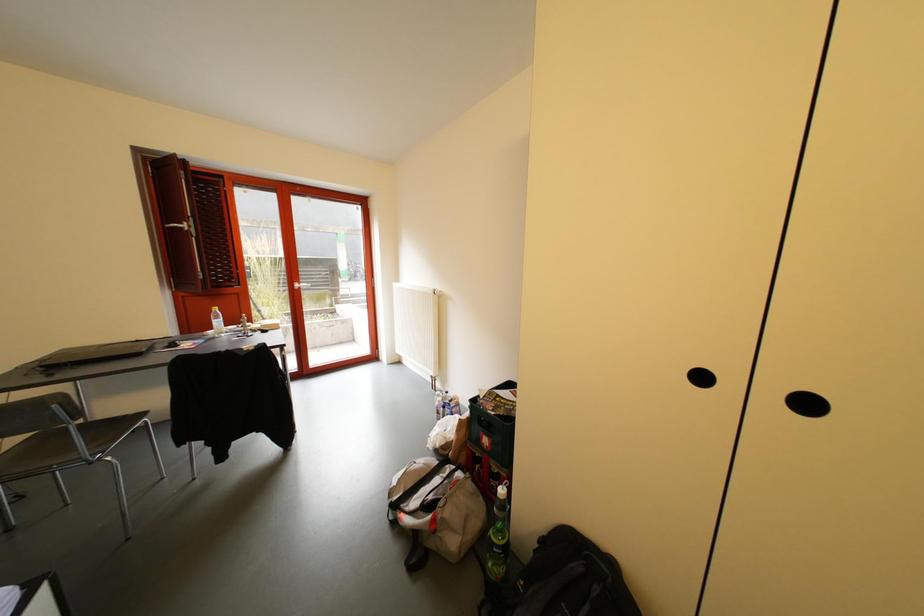
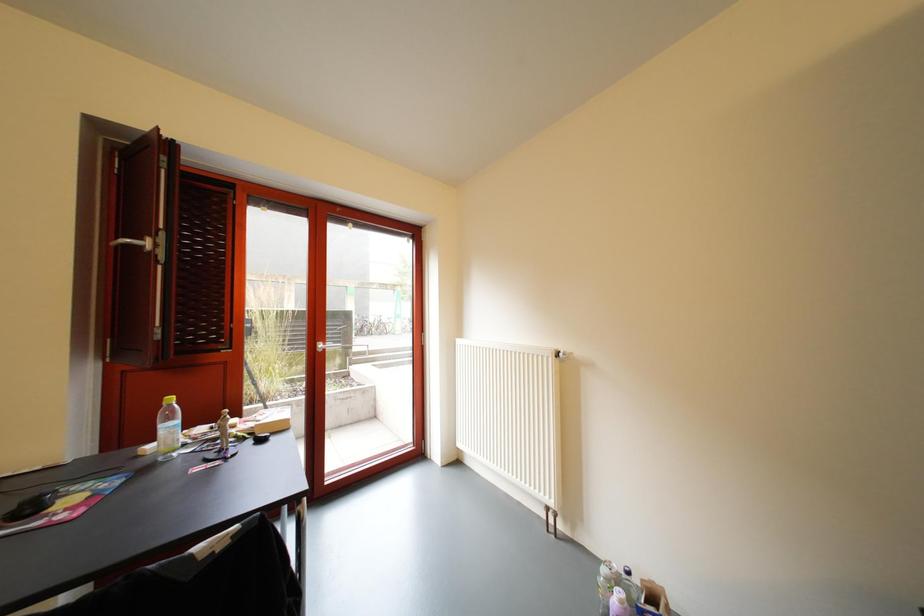
The images are taken continuously from a first-person perspective. In which direction are you moving?

The movement direction of the cameraman is left, forward.